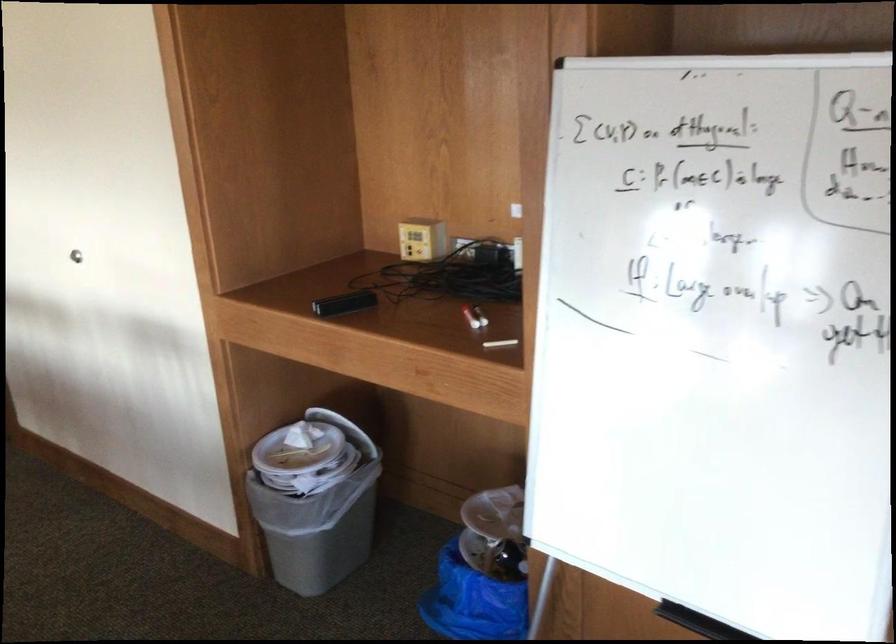
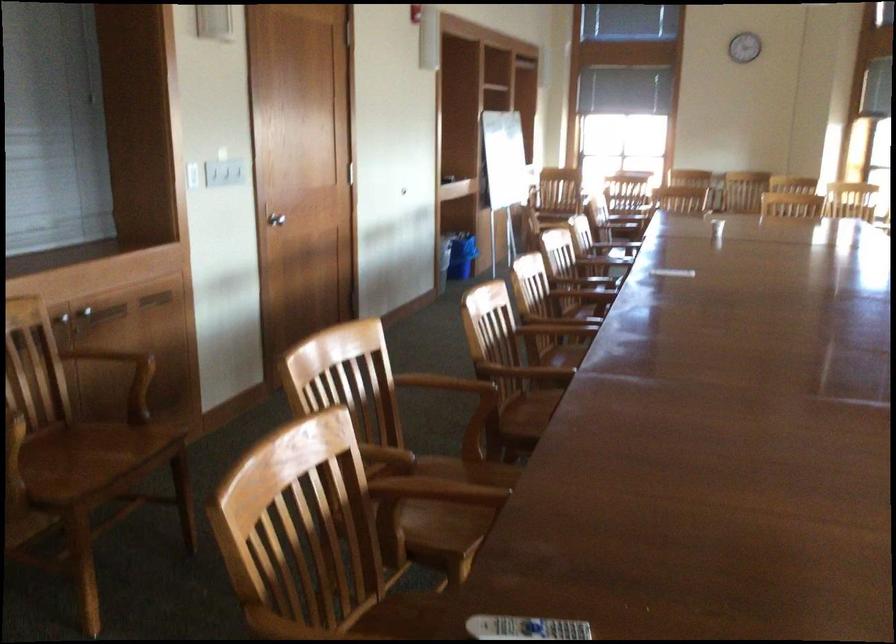
Question: I am providing you with two images of the same scene from different viewpoints. Please identify which objects are invisible in image2.

Choices:
 (A) black rectangular device
 (B) floral patterned pillow
 (C) white remote control
 (D) wooden chair armrest

Answer: (A)